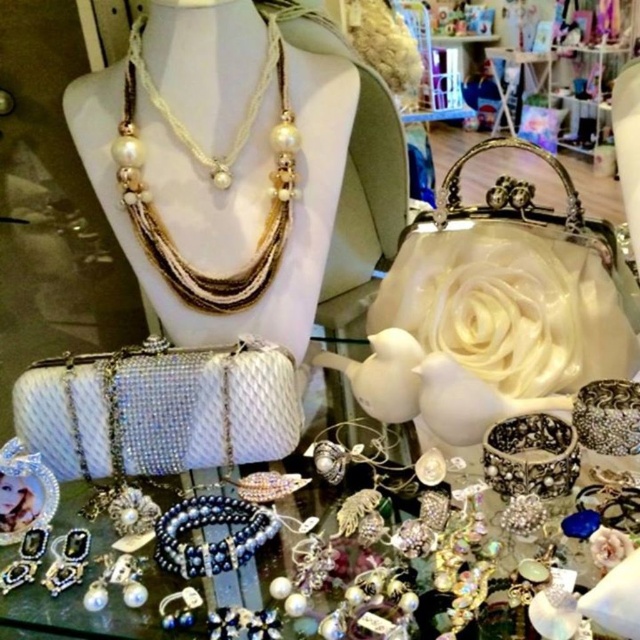
Is pearl-strand necklace at upper center positioned before satin black beaded bracelet at center?

No, it is behind satin black beaded bracelet at center.

Can you confirm if pearl-strand necklace at upper center is thinner than satin black beaded bracelet at center?

No.

This screenshot has height=640, width=640. I want to click on pearl-strand necklace at upper center, so click(212, 180).

Where is `pearl-strand necklace at upper center`? The image size is (640, 640). pearl-strand necklace at upper center is located at coordinates (212, 180).

Does pearl-strand necklace at upper center lie in front of pearl-strand necklace at center?

Yes.

Which of these two, pearl-strand necklace at upper center or pearl-strand necklace at center, stands taller?

With more height is pearl-strand necklace at upper center.

Find the location of a particular element. The image size is (640, 640). pearl-strand necklace at upper center is located at coordinates (212, 180).

Identify the location of pearl-strand necklace at upper center. The width and height of the screenshot is (640, 640). (212, 180).

What do you see at coordinates (211, 541) in the screenshot? I see `satin black beaded bracelet at center` at bounding box center [211, 541].

Measure the distance between satin black beaded bracelet at center and camera.

satin black beaded bracelet at center is 33.00 inches away from camera.

Where is `satin black beaded bracelet at center`? satin black beaded bracelet at center is located at coordinates (211, 541).